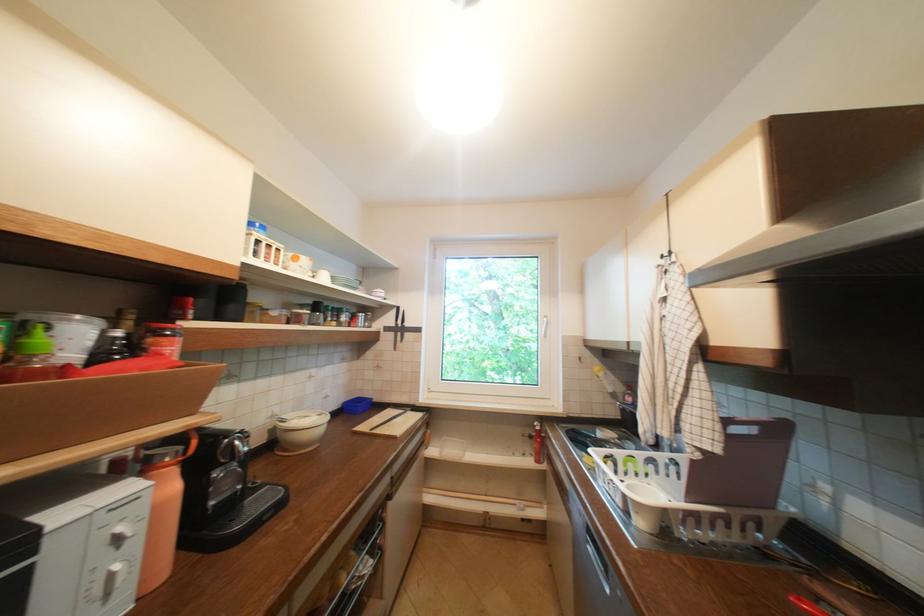
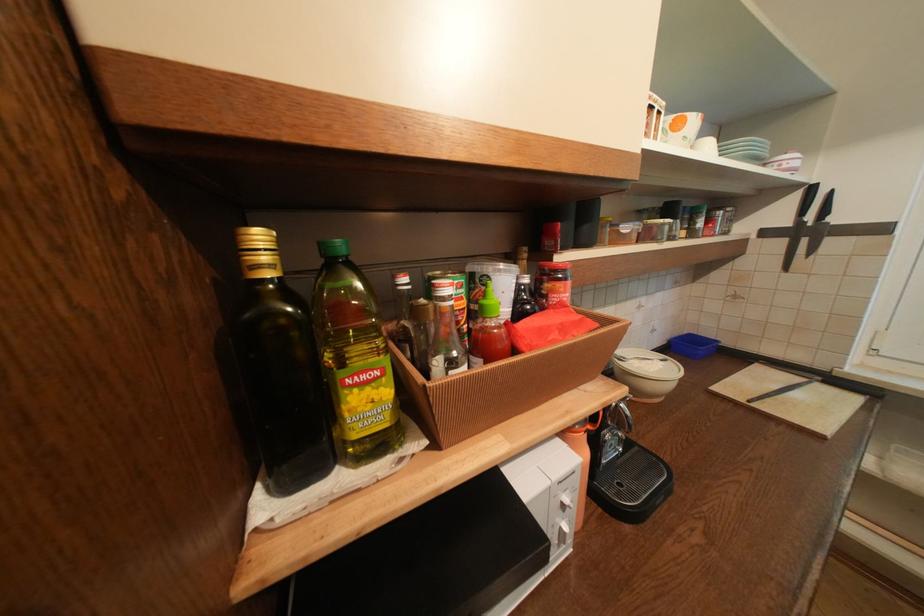
In the second image, find the point that corresponds to (403,312) in the first image.

(807, 196)